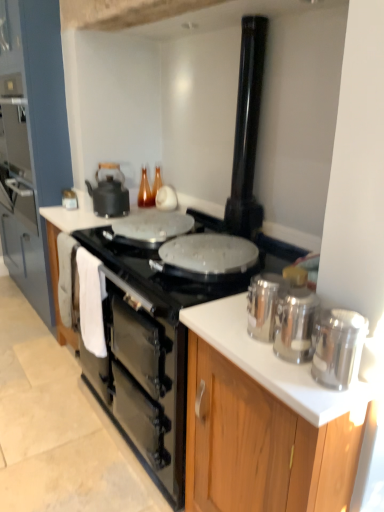
The image size is (384, 512). I want to click on vacant space to the left of silver metallic canisters at right, which is the 2th kitchen appliance from top to bottom, so click(x=219, y=330).